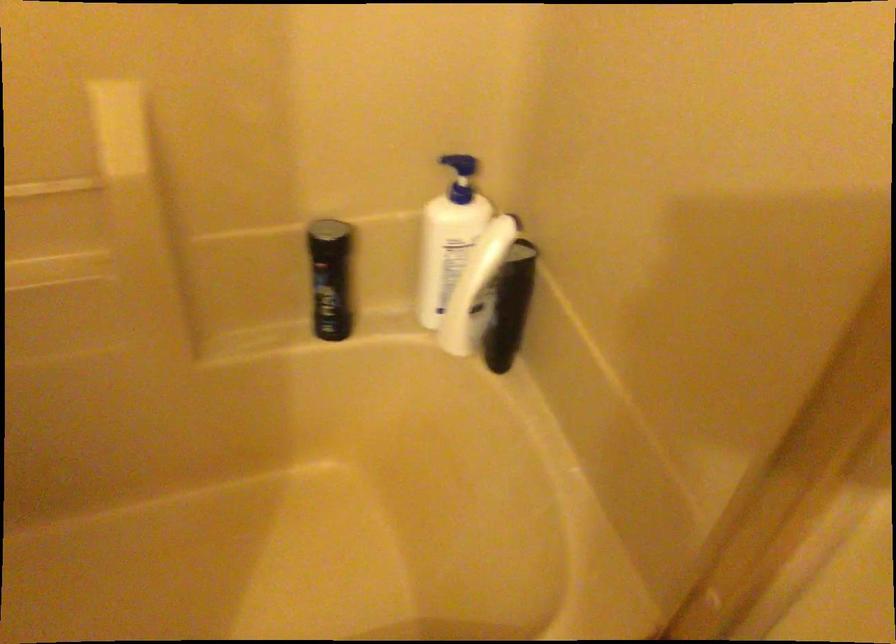
The height and width of the screenshot is (644, 896). Describe the element at coordinates (460, 166) in the screenshot. I see `the blue pump dispenser` at that location.